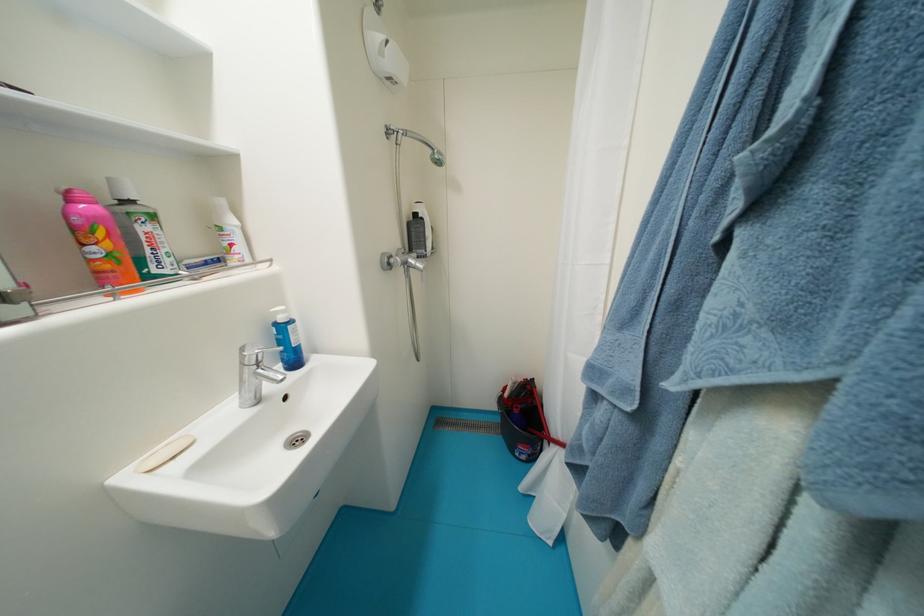
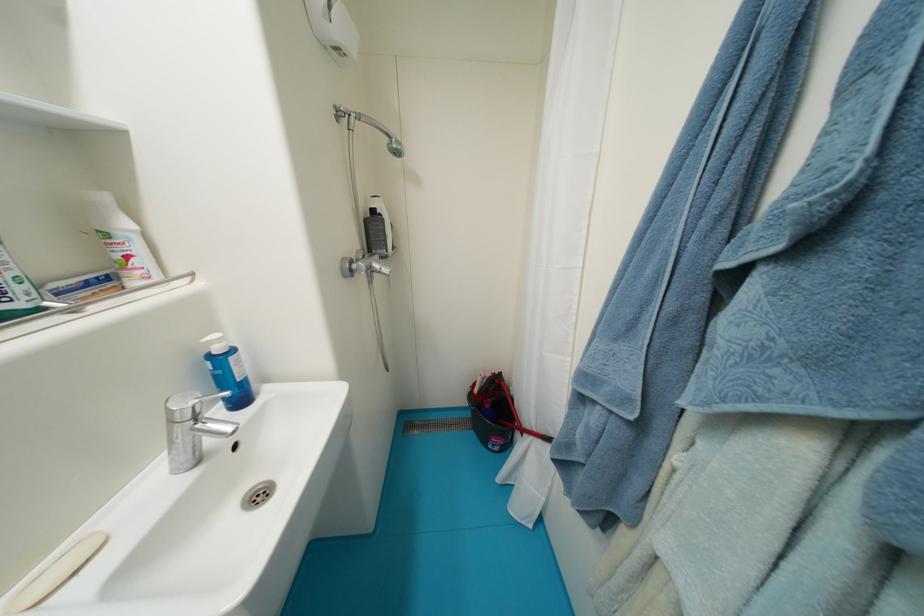
Locate, in the second image, the point that corresponds to [418,262] in the first image.

(383, 267)